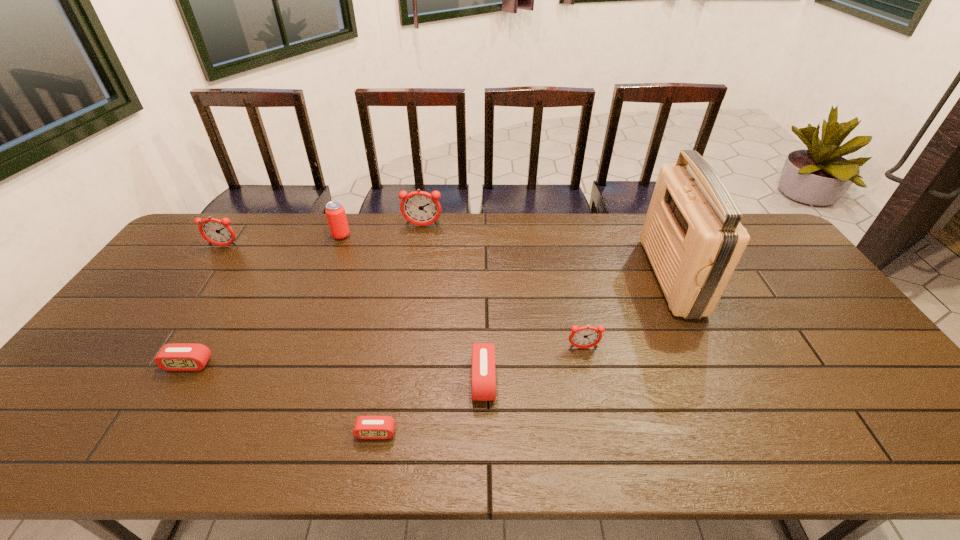
Identify the location of the tallest object. (692, 235).

Where is `beige radio receiver`? The height and width of the screenshot is (540, 960). beige radio receiver is located at coordinates (692, 235).

You are a GUI agent. You are given a task and a screenshot of the screen. Output one action in this format:
    pyautogui.click(x=<x>, y=<y>)
    Task: Click on the farthest object
    This screenshot has height=540, width=960.
    Given the screenshot: What is the action you would take?
    pyautogui.click(x=420, y=208)

At what (x,y) coordinates should I click in order to perform the action: click on the second reddish-pink alarm clock from right to left. Please return your answer as a coordinate pair (x, y). This screenshot has width=960, height=540. Looking at the image, I should click on (420, 208).

Locate an element on the screen. The width and height of the screenshot is (960, 540). red beer can is located at coordinates (335, 212).

Where is `the sixth object from right to left`? The image size is (960, 540). the sixth object from right to left is located at coordinates (335, 212).

Identify the location of the second farthest reddish-pink alarm clock. Image resolution: width=960 pixels, height=540 pixels. (218, 232).

The image size is (960, 540). I want to click on the fifth nearest alarm clock, so click(x=218, y=232).

Locate an element on the screen. the fifth tallest object is located at coordinates (583, 337).

Where is `the second object from right to left`? This screenshot has height=540, width=960. the second object from right to left is located at coordinates (583, 337).